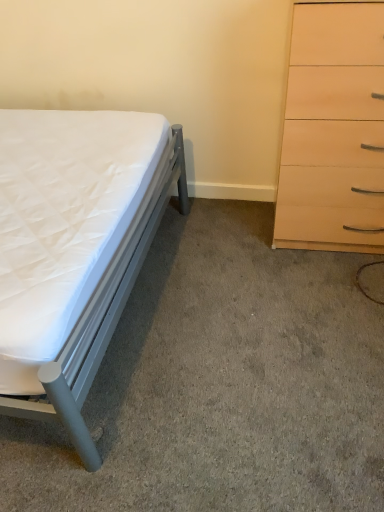
Question: Can you confirm if white quilted mattress at left is taller than light wood/finish chest of drawers at right?

Choices:
 (A) yes
 (B) no

Answer: (B)

Question: Does white quilted mattress at left appear on the left side of light wood/finish chest of drawers at right?

Choices:
 (A) yes
 (B) no

Answer: (A)

Question: Is white quilted mattress at left further to camera compared to light wood/finish chest of drawers at right?

Choices:
 (A) yes
 (B) no

Answer: (B)

Question: Is white quilted mattress at left bigger than light wood/finish chest of drawers at right?

Choices:
 (A) no
 (B) yes

Answer: (B)

Question: From a real-world perspective, is white quilted mattress at left positioned under light wood/finish chest of drawers at right based on gravity?

Choices:
 (A) no
 (B) yes

Answer: (B)

Question: Is light wood/finish chest of drawers at right located within white quilted mattress at left?

Choices:
 (A) yes
 (B) no

Answer: (B)

Question: Considering the relative positions of light wood/finish chest of drawers at right and white quilted mattress at left in the image provided, is light wood/finish chest of drawers at right in front of white quilted mattress at left?

Choices:
 (A) no
 (B) yes

Answer: (A)

Question: From the image's perspective, is light wood/finish chest of drawers at right on top of white quilted mattress at left?

Choices:
 (A) yes
 (B) no

Answer: (A)

Question: Is light wood/finish chest of drawers at right outside white quilted mattress at left?

Choices:
 (A) yes
 (B) no

Answer: (A)

Question: Could you tell me if light wood/finish chest of drawers at right is turned towards white quilted mattress at left?

Choices:
 (A) no
 (B) yes

Answer: (A)

Question: Does light wood/finish chest of drawers at right lie behind white quilted mattress at left?

Choices:
 (A) yes
 (B) no

Answer: (A)

Question: From a real-world perspective, is light wood/finish chest of drawers at right located beneath white quilted mattress at left?

Choices:
 (A) yes
 (B) no

Answer: (B)

Question: Can you confirm if white quilted mattress at left is positioned to the left of white quilted mattress at lower left?

Choices:
 (A) yes
 (B) no

Answer: (A)